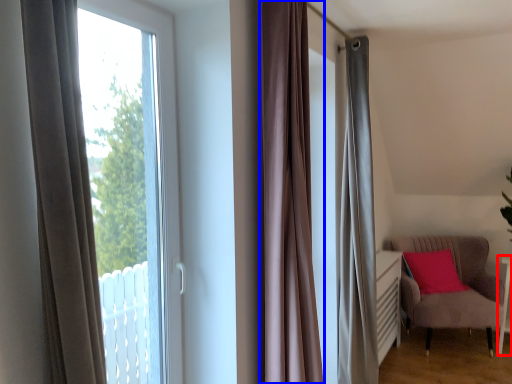
Question: Which point is further to the camera, side table (highlighted by a red box) or curtain (highlighted by a blue box)?

Choices:
 (A) side table
 (B) curtain

Answer: (A)